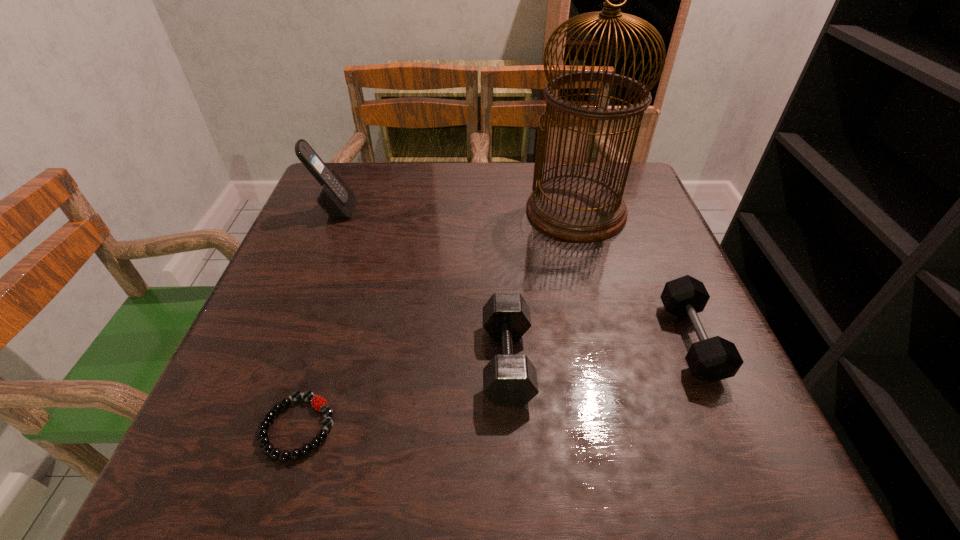
Locate an element on the screen. The height and width of the screenshot is (540, 960). free space at the far edge is located at coordinates [x=393, y=187].

In order to click on free space at the left edge of the desktop in this screenshot , I will do `click(370, 218)`.

Where is `vacant space at the far left corner of the desktop`? This screenshot has height=540, width=960. vacant space at the far left corner of the desktop is located at coordinates (345, 172).

Locate an element on the screen. The width and height of the screenshot is (960, 540). vacant position at the far right corner of the desktop is located at coordinates (578, 171).

Identify the location of free area in between the right dumbbell and the cellular telephone. (513, 275).

Locate an element on the screen. The width and height of the screenshot is (960, 540). vacant area that lies between the left dumbbell and the tallest object is located at coordinates (541, 286).

Locate an element on the screen. unoccupied area between the tallest object and the third object from left to right is located at coordinates (541, 286).

The height and width of the screenshot is (540, 960). What are the coordinates of `free space between the right dumbbell and the birdcage` in the screenshot? It's located at (634, 275).

Find the location of a particular element. free space between the right dumbbell and the fourth shortest object is located at coordinates (513, 275).

The image size is (960, 540). I want to click on vacant point located between the third object from right to left and the right dumbbell, so click(599, 351).